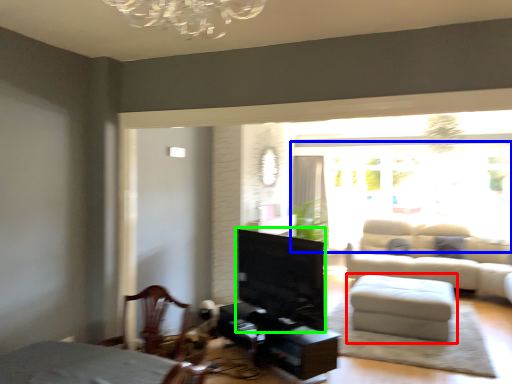
Question: Which object is positioned farthest from table (highlighted by a red box)? Select from window screen (highlighted by a blue box) and fireplace (highlighted by a green box).

Choices:
 (A) window screen
 (B) fireplace

Answer: (A)